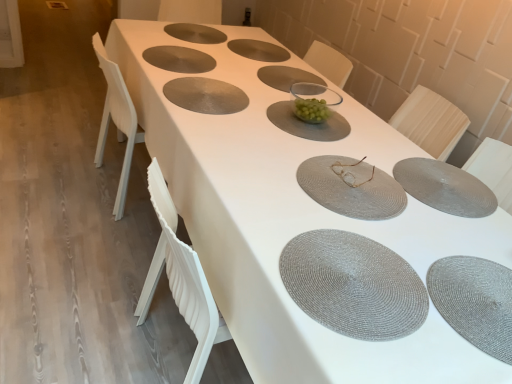
Identify the location of vacant space that's between matte gray placemat at center, the seventh tableware when ordered from top to bottom, and gray woven placemat at center, the 8th tableware positioned from the top. This screenshot has height=384, width=512. (395, 180).